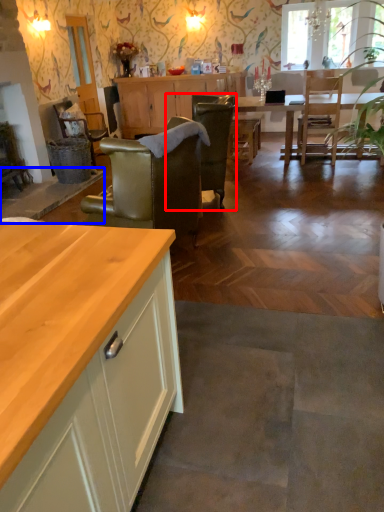
Question: Which point is closer to the camera, chair (highlighted by a red box) or counter (highlighted by a blue box)?

Choices:
 (A) chair
 (B) counter

Answer: (A)